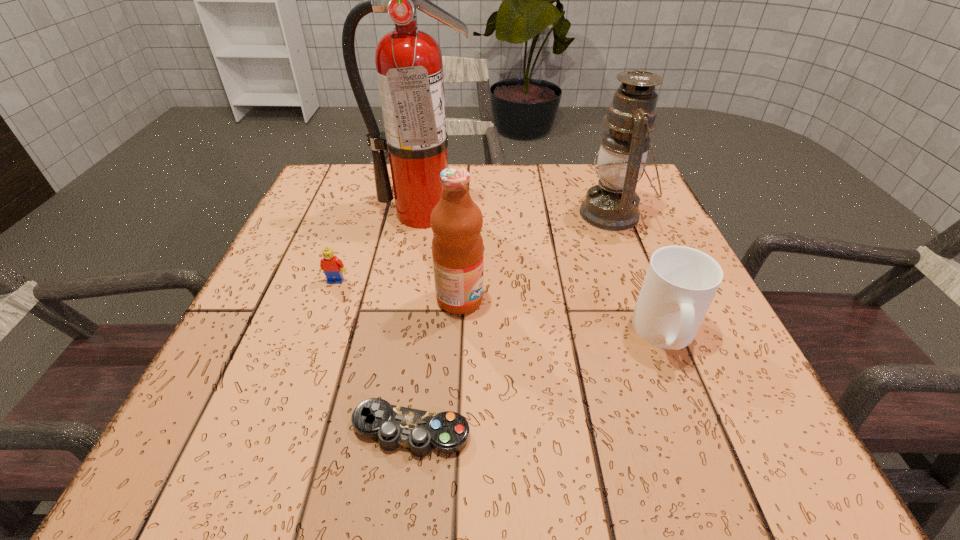
I want to click on vacant region located 0.060m on the front label of the fruit juice, so click(515, 299).

The width and height of the screenshot is (960, 540). I want to click on blank space located 0.080m on the handle side of the third shortest object, so click(698, 410).

This screenshot has width=960, height=540. Find the location of `free point located on the face of the leftmost object`. free point located on the face of the leftmost object is located at coordinates (282, 430).

What are the coordinates of `vacant space located on the left of the control` in the screenshot? It's located at (285, 430).

Locate an element on the screen. The image size is (960, 540). fire extinguisher situated at the far edge is located at coordinates (409, 67).

Find the location of a particular element. The image size is (960, 540). oil lamp positioned at the far edge is located at coordinates (612, 204).

Where is `object present at the near edge`? object present at the near edge is located at coordinates (447, 432).

Image resolution: width=960 pixels, height=540 pixels. I want to click on object located in the left edge section of the desktop, so click(333, 267).

You are a GUI agent. You are given a task and a screenshot of the screen. Output one action in this format:
    pyautogui.click(x=<x>, y=<y>)
    Task: Click on the oil lamp situated at the right edge
    Image resolution: width=960 pixels, height=540 pixels.
    Given the screenshot: What is the action you would take?
    pyautogui.click(x=612, y=204)

The image size is (960, 540). I want to click on mug at the right edge, so click(680, 283).